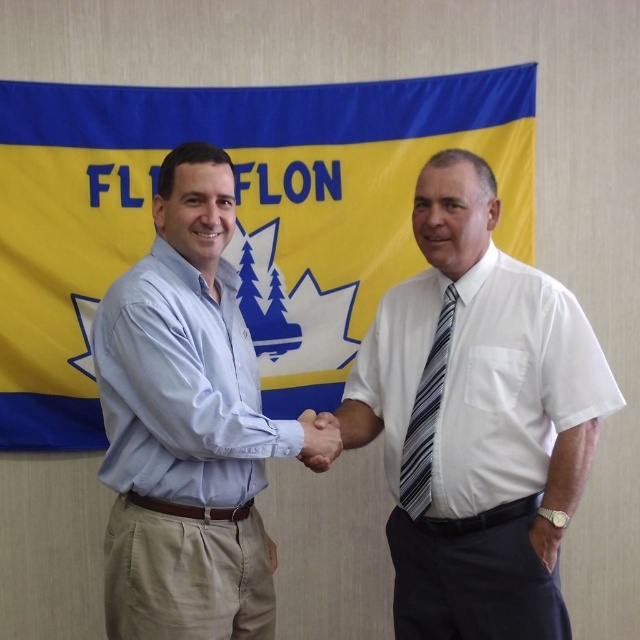
Which is behind, point (429, 401) or point (307, 452)?

The point (429, 401) is behind.

Which is in front, point (419, 381) or point (332, 452)?

Point (332, 452) is in front.

At what (x,y) coordinates should I click in order to perform the action: click on striped fabric tie at center. Please return your answer as a coordinate pair (x, y). Looking at the image, I should click on (426, 417).

Can you confirm if light blue shirt at center is positioned to the left of smooth skin handshake at center?

Yes, light blue shirt at center is to the left of smooth skin handshake at center.

Can you confirm if light blue shirt at center is positioned above smooth skin handshake at center?

Correct, light blue shirt at center is located above smooth skin handshake at center.

The height and width of the screenshot is (640, 640). What are the coordinates of `light blue shirt at center` in the screenshot? It's located at (186, 424).

Can you confirm if light blue shirt at center is wider than striped fabric tie at center?

Correct, the width of light blue shirt at center exceeds that of striped fabric tie at center.

At what (x,y) coordinates should I click in order to perform the action: click on light blue shirt at center. Please return your answer as a coordinate pair (x, y). Looking at the image, I should click on (186, 424).

What are the coordinates of `light blue shirt at center` in the screenshot? It's located at (186, 424).